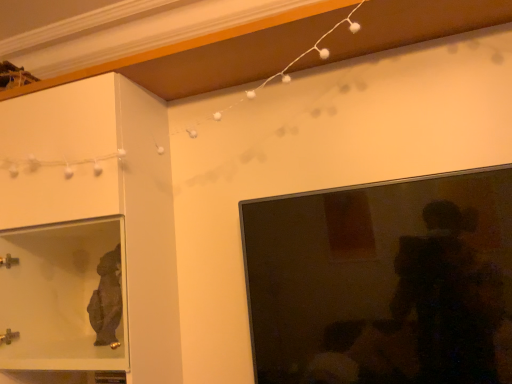
At what (x,y) coordinates should I click in order to perform the action: click on matte glass cabinet at left. Please return your answer as a coordinate pair (x, y). The width and height of the screenshot is (512, 384). Looking at the image, I should click on (105, 195).

This screenshot has width=512, height=384. What do you see at coordinates (105, 195) in the screenshot? I see `matte glass cabinet at left` at bounding box center [105, 195].

What is the approximate height of matte glass cabinet at left?

The height of matte glass cabinet at left is 38.49 inches.

The image size is (512, 384). Describe the element at coordinates (383, 282) in the screenshot. I see `matte black tv at right` at that location.

Image resolution: width=512 pixels, height=384 pixels. I want to click on matte black tv at right, so click(x=383, y=282).

What is the approximate height of matte black tv at right?

matte black tv at right is 21.28 inches tall.

Find the location of a particular element. This screenshot has height=384, width=512. matte glass cabinet at left is located at coordinates (105, 195).

Can you confirm if matte black tv at right is positioned to the left of matte glass cabinet at left?

In fact, matte black tv at right is to the right of matte glass cabinet at left.

Is matte black tv at right positioned before matte glass cabinet at left?

Yes, matte black tv at right is closer to the viewer.

Does point (378, 360) lie behind point (150, 126)?

No, (378, 360) is in front of (150, 126).

From the image's perspective, is matte black tv at right over matte glass cabinet at left?

No, from the image's perspective, matte black tv at right is not over matte glass cabinet at left.

From a real-world perspective, who is located lower, matte black tv at right or matte glass cabinet at left?

matte black tv at right.

Based on the photo, can you confirm if matte black tv at right is thinner than matte glass cabinet at left?

Yes, matte black tv at right is thinner than matte glass cabinet at left.

Is matte black tv at right taller or shorter than matte glass cabinet at left?

Considering their sizes, matte black tv at right has less height than matte glass cabinet at left.

Considering the relative sizes of matte black tv at right and matte glass cabinet at left in the image provided, is matte black tv at right bigger than matte glass cabinet at left?

Incorrect, matte black tv at right is not larger than matte glass cabinet at left.

Does matte black tv at right contain matte glass cabinet at left?

Definitely not — matte glass cabinet at left is not inside matte black tv at right.

Are matte black tv at right and matte glass cabinet at left located far from each other?

No, matte black tv at right is in close proximity to matte glass cabinet at left.

Is matte black tv at right facing away from matte glass cabinet at left?

No, matte black tv at right's orientation is not away from matte glass cabinet at left.

Looking at this image, can you tell me how much matte black tv at right and matte glass cabinet at left differ in facing direction?

The angle between the facing direction of matte black tv at right and the facing direction of matte glass cabinet at left is 1.31 degrees.

I want to click on picture frame that appears below the matte glass cabinet at left (from the image's perspective), so click(383, 282).

Considering the positions of objects matte glass cabinet at left and matte black tv at right in the image provided, who is more to the right, matte glass cabinet at left or matte black tv at right?

From the viewer's perspective, matte black tv at right appears more on the right side.

Relative to matte black tv at right, is matte glass cabinet at left in front or behind?

Clearly, matte glass cabinet at left is behind matte black tv at right.

Based on the photo, which point is more distant from viewer, (100, 182) or (370, 369)?

The point (100, 182) is more distant.

From the image's perspective, is matte glass cabinet at left beneath matte black tv at right?

Actually, matte glass cabinet at left appears above matte black tv at right in the image.

From a real-world perspective, relative to matte black tv at right, is matte glass cabinet at left vertically above or below?

Clearly, from a real-world perspective, matte glass cabinet at left is above matte black tv at right.

Considering the relative sizes of matte glass cabinet at left and matte black tv at right in the image provided, is matte glass cabinet at left wider than matte black tv at right?

Indeed, matte glass cabinet at left has a greater width compared to matte black tv at right.

Consider the image. Which of these two, matte glass cabinet at left or matte black tv at right, stands taller?

With more height is matte glass cabinet at left.

Considering the sizes of objects matte glass cabinet at left and matte black tv at right in the image provided, who is smaller, matte glass cabinet at left or matte black tv at right?

matte black tv at right.

Is matte glass cabinet at left outside of matte black tv at right?

Yes, matte glass cabinet at left is located beyond the bounds of matte black tv at right.

Are matte glass cabinet at left and matte black tv at right making contact?

No, matte glass cabinet at left is not touching matte black tv at right.

Is matte glass cabinet at left oriented towards matte black tv at right?

No, matte glass cabinet at left is not facing towards matte black tv at right.

Can you tell me how much matte glass cabinet at left and matte black tv at right differ in facing direction?

They differ by 1.31 degrees in their facing directions.

Find the location of a particular element. Image resolution: width=512 pixels, height=384 pixels. picture frame that appears below the matte glass cabinet at left (from the image's perspective) is located at coordinates (383, 282).

This screenshot has width=512, height=384. What are the coordinates of `cabinetry that appears behind the matte black tv at right` in the screenshot? It's located at point(105,195).

Image resolution: width=512 pixels, height=384 pixels. In the image, there is a matte glass cabinet at left. What are the coordinates of `picture frame below it (from the image's perspective)` in the screenshot? It's located at (383, 282).